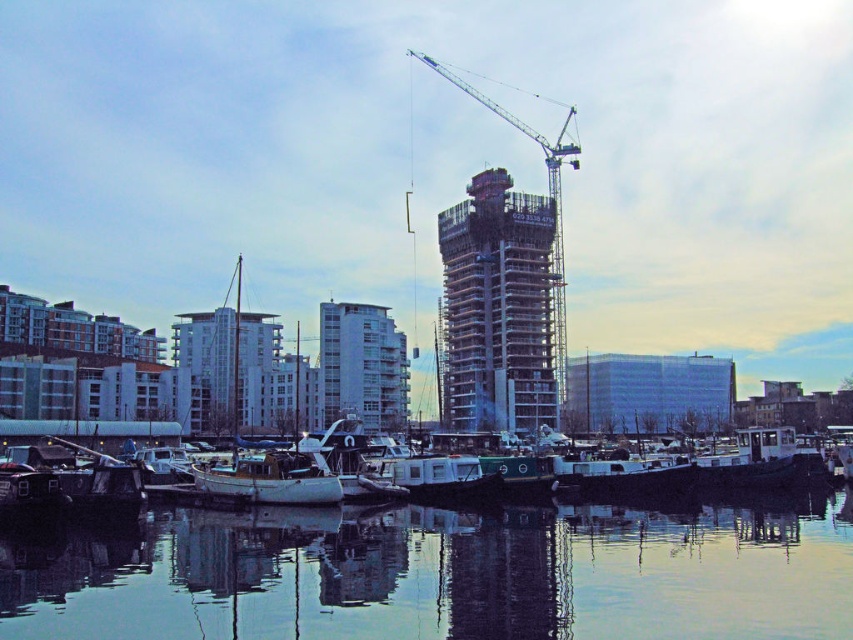
Looking at this image, you are standing at the point closest to the waterfront in the image. Which of the two points, point (x=312, y=488) or point (x=397, y=445), is closer to you?

Point (x=312, y=488) is in front of point (x=397, y=445), so it is closer to you.

You are planning to install a floating dock for a boat. The dock requires a space wider than the white concrete building at center. Can the reflective glass water at center accommodate this requirement?

The reflective glass water at center might be wider than the white concrete building at center, so it could potentially accommodate the dock if the water is indeed wider. However, exact measurements would be needed to confirm.

You are standing on the shore looking at the white concrete building at center and the white matte boat at center. Which one is closer to you?

The white concrete building at center is closer to you because the white matte boat at center is behind it.